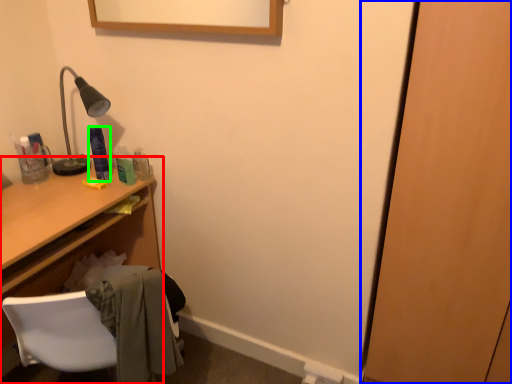
Question: Considering the real-world distances, which object is closest to desk (highlighted by a red box)? door (highlighted by a blue box) or toiletry (highlighted by a green box).

Choices:
 (A) door
 (B) toiletry

Answer: (B)